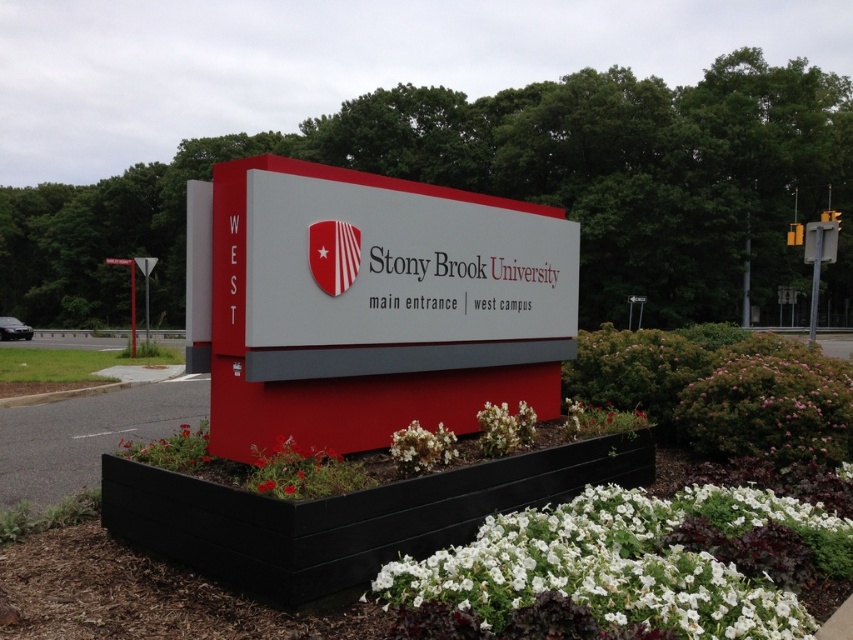
Is white matte flower at center bigger than white matte flower at lower center?

Incorrect, white matte flower at center is not larger than white matte flower at lower center.

Between white matte flower at center and white matte flower at lower center, which one has more height?

Standing taller between the two is white matte flower at lower center.

Who is more forward, (426, 464) or (532, 428)?

Point (426, 464)

This screenshot has width=853, height=640. Identify the location of white matte flower at center. (421, 449).

Is point (809, 458) farther from camera compared to point (483, 442)?

Yes.

Does pink matte bush at lower right have a smaller size compared to white matte flower at lower center?

No.

At what (x,y) coordinates should I click in order to perform the action: click on pink matte bush at lower right. Please return your answer as a coordinate pair (x, y). Looking at the image, I should click on (770, 404).

This screenshot has width=853, height=640. Identify the location of pink matte bush at lower right. (770, 404).

Between white matte petal at lower center and pink matte bush at lower right, which one has less height?

With less height is white matte petal at lower center.

Measure the distance between white matte petal at lower center and camera.

The distance of white matte petal at lower center from camera is 9.34 feet.

Where is `white matte petal at lower center`? white matte petal at lower center is located at coordinates (625, 563).